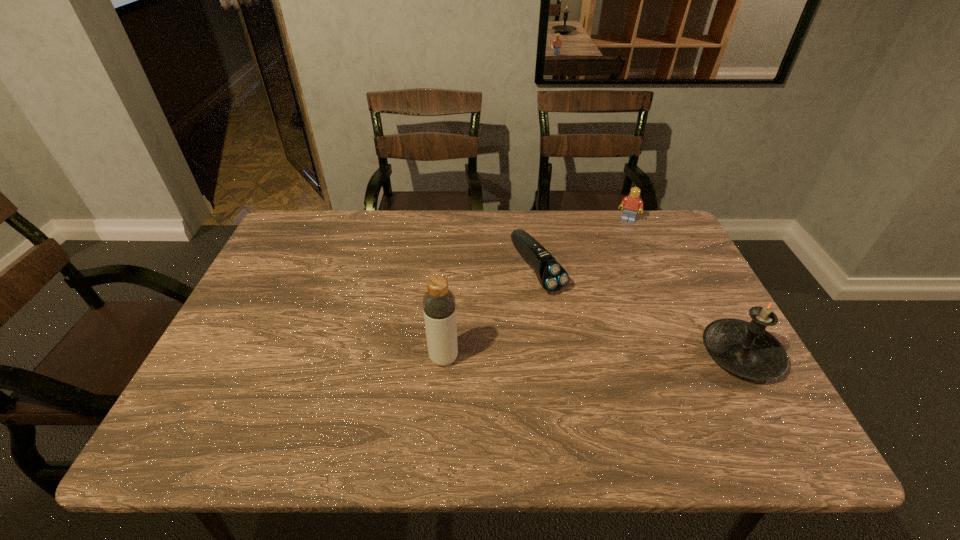
Image resolution: width=960 pixels, height=540 pixels. Find the location of `vacant space located 0.360m on the head of the third nearest object`. vacant space located 0.360m on the head of the third nearest object is located at coordinates (645, 403).

Locate an element on the screen. This screenshot has height=540, width=960. vacant space situated 0.160m on the head of the third nearest object is located at coordinates tap(589, 338).

Locate an element on the screen. This screenshot has width=960, height=540. free spot located on the front-facing side of the second shortest object is located at coordinates (613, 260).

Locate an element on the screen. vacant region located on the front-facing side of the second shortest object is located at coordinates (601, 298).

This screenshot has width=960, height=540. I want to click on free space located on the front-facing side of the second shortest object, so click(x=614, y=256).

You are a GUI agent. You are given a task and a screenshot of the screen. Output one action in this format:
    pyautogui.click(x=<x>, y=<y>)
    Task: Click on the electric shaver located in the far edge section of the desktop
    This screenshot has width=960, height=540.
    Given the screenshot: What is the action you would take?
    pyautogui.click(x=551, y=275)

What are the coordinates of `Lego that is at the far edge` in the screenshot? It's located at (632, 203).

I want to click on object situated at the near edge, so click(x=746, y=349).

Where is `candle positioned at the right edge`? candle positioned at the right edge is located at coordinates (746, 349).

Locate an element on the screen. Lego present at the right edge is located at coordinates (632, 203).